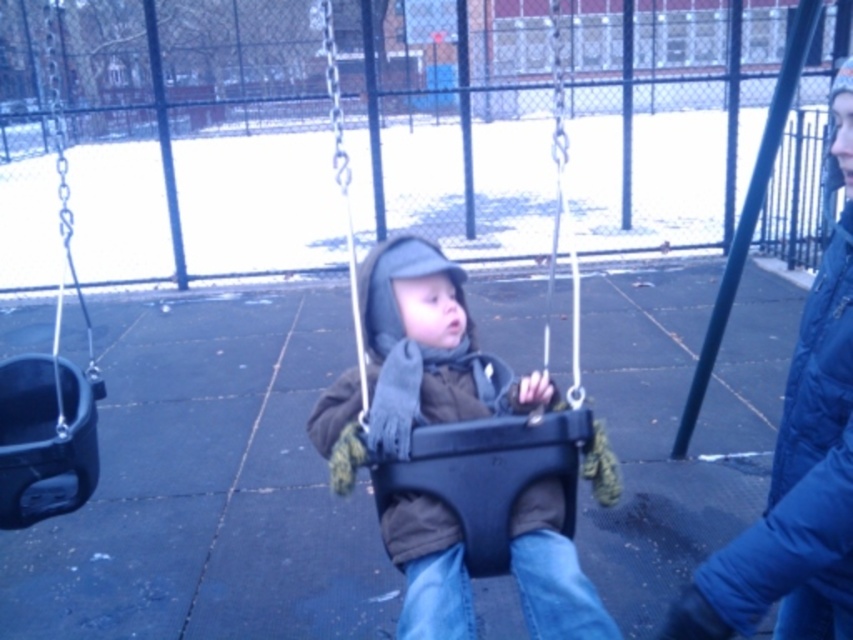
Question: Can you confirm if brown matte jacket at center is positioned to the left of blue fleece jacket at center?

Choices:
 (A) yes
 (B) no

Answer: (A)

Question: Which point is farther to the camera?

Choices:
 (A) brown matte jacket at center
 (B) blue fleece jacket at center
 (C) black plastic swing at left
 (D) black plastic swing at center

Answer: (C)

Question: Can you confirm if brown matte jacket at center is smaller than black plastic swing at center?

Choices:
 (A) no
 (B) yes

Answer: (A)

Question: Does black plastic swing at center appear on the right side of black plastic swing at left?

Choices:
 (A) no
 (B) yes

Answer: (B)

Question: Which of the following is the farthest from the observer?

Choices:
 (A) (61, 298)
 (B) (757, 612)

Answer: (A)

Question: Based on their relative distances, which object is nearer to the blue fleece jacket at center?

Choices:
 (A) brown matte jacket at center
 (B) black plastic swing at left
 (C) black plastic swing at center

Answer: (C)